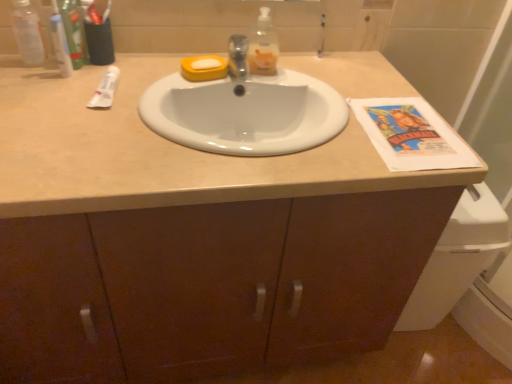
Find the location of a particular element. vacant space to the right of green plastic toothpaste tube at upper left, which ranks as the first toiletry in left-to-right order is located at coordinates (144, 71).